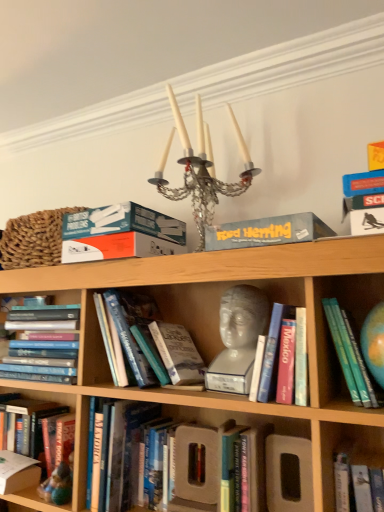
This screenshot has height=512, width=384. Find the location of `empty space that is ontop of hardcover book at lower left, positioned as the third paperback book in top-to-bottom order`. empty space that is ontop of hardcover book at lower left, positioned as the third paperback book in top-to-bottom order is located at coordinates (14, 456).